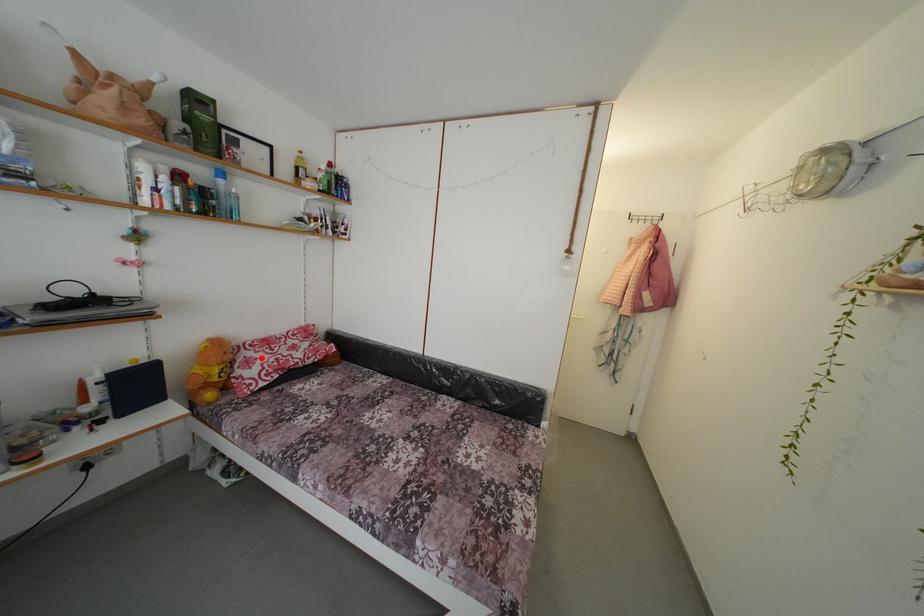
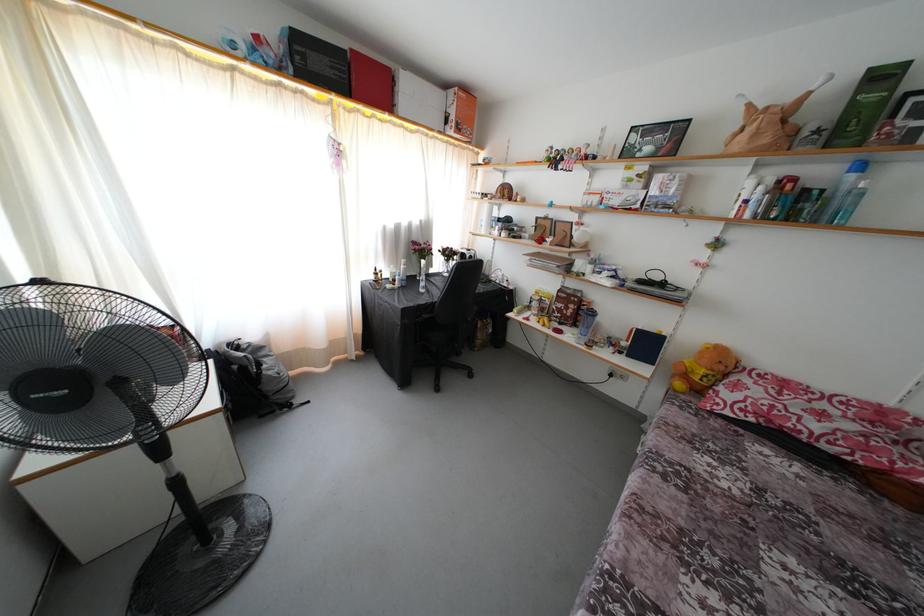
Find the pixel in the second image that matches the highlighted location in the first image.

(760, 389)